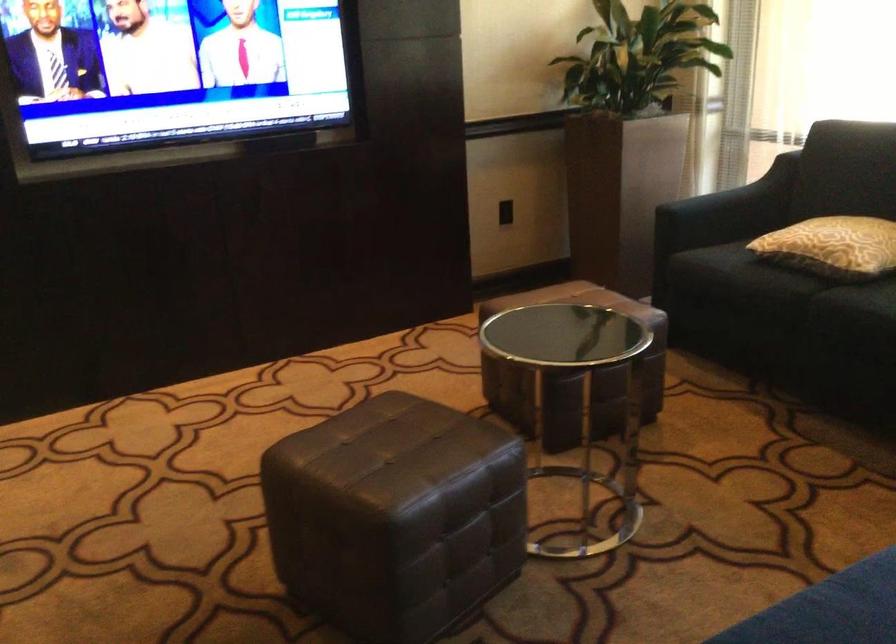
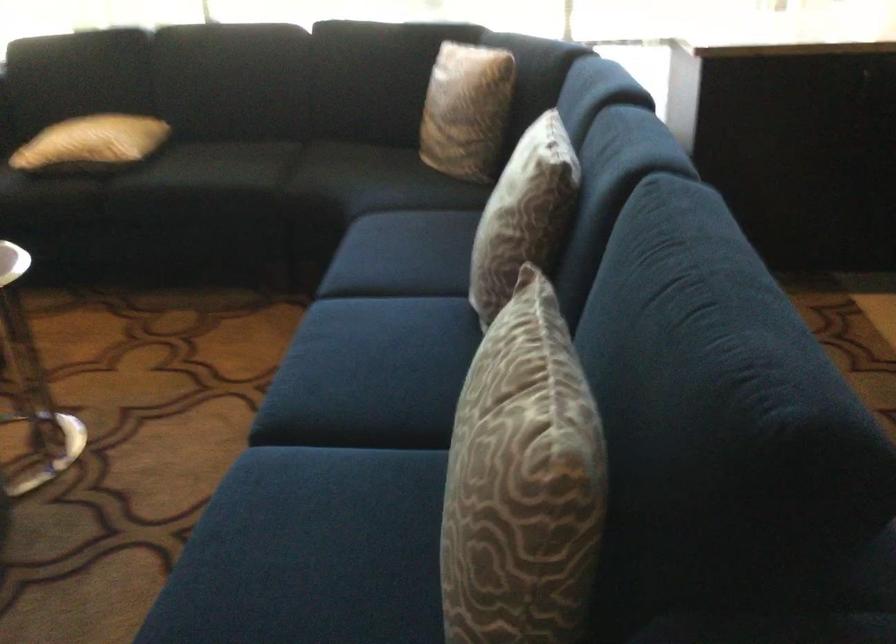
Question: Based on the continuous images, in which direction is the camera rotating? Reply with the corresponding letter.

Choices:
 (A) Left
 (B) Right
 (C) Up
 (D) Down

Answer: (B)